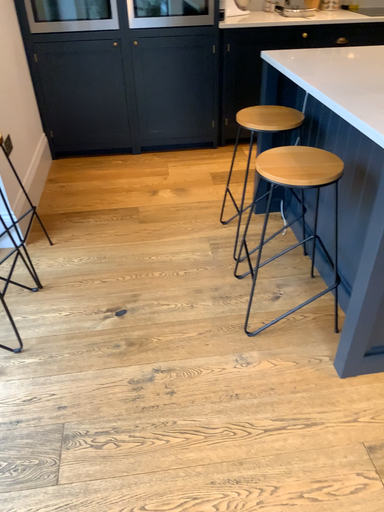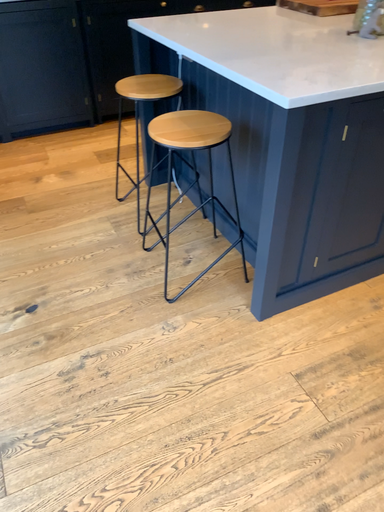
Question: Which way did the camera rotate in the video?

Choices:
 (A) rotated right
 (B) rotated left

Answer: (A)